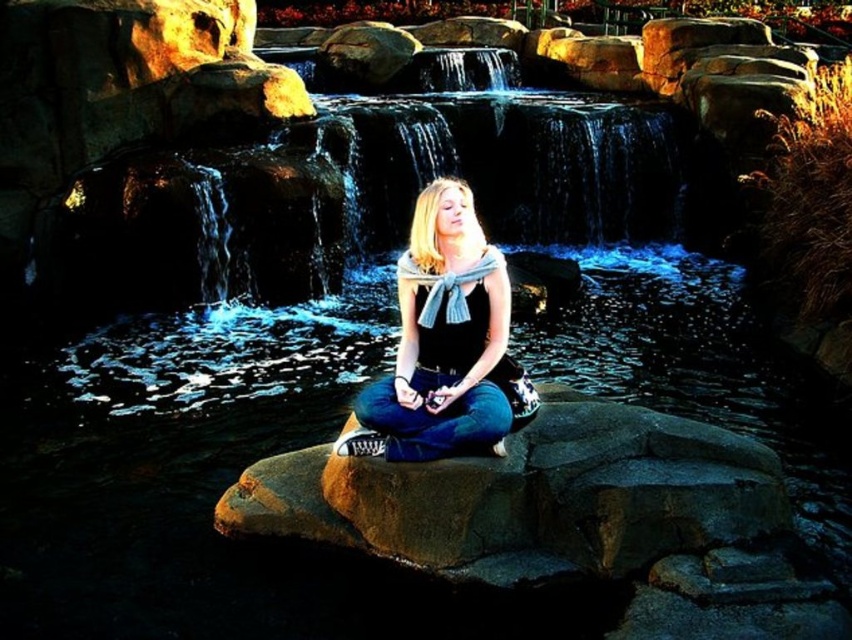
Question: Which point is closer to the camera taking this photo?

Choices:
 (A) 544,403
 (B) 478,451

Answer: (B)

Question: Does brown rough rock at center lie behind matte black tank top at center?

Choices:
 (A) no
 (B) yes

Answer: (A)

Question: Which point appears closest to the camera in this image?

Choices:
 (A) (413, 250)
 (B) (525, 467)

Answer: (B)

Question: Which point is closer to the camera?

Choices:
 (A) pos(281,474)
 (B) pos(364,424)

Answer: (B)

Question: Does brown rough rock at center appear on the right side of matte black tank top at center?

Choices:
 (A) no
 (B) yes

Answer: (B)

Question: Is brown rough rock at center above matte black tank top at center?

Choices:
 (A) no
 (B) yes

Answer: (A)